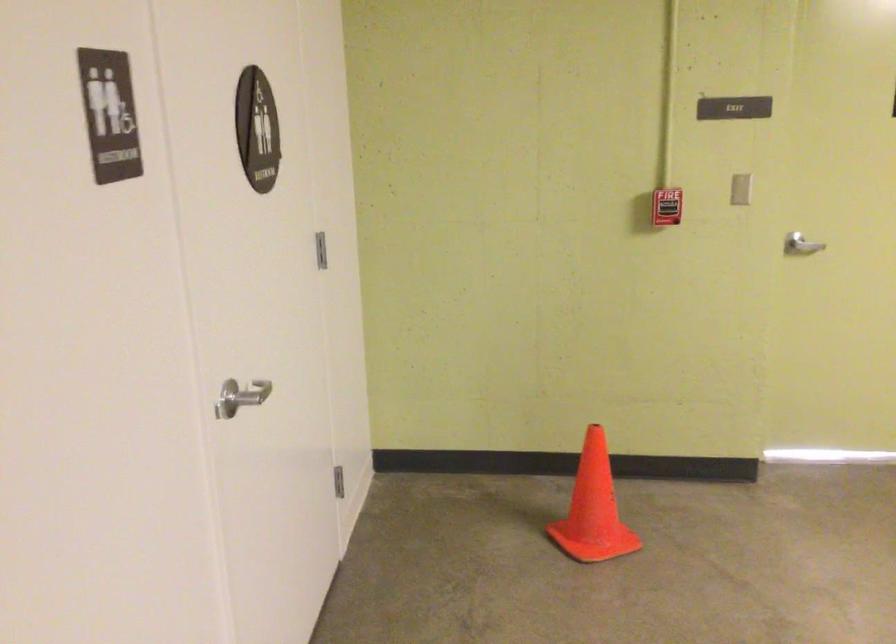
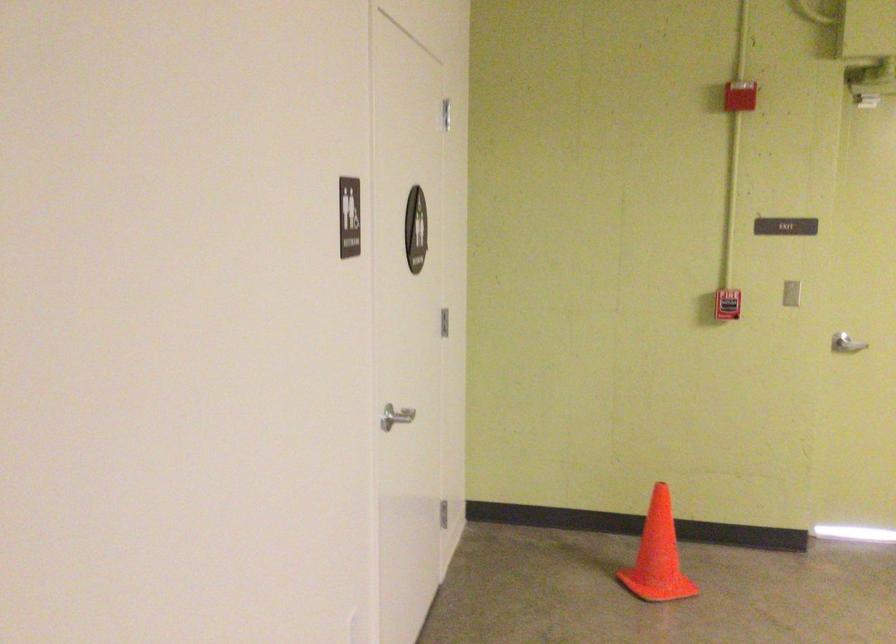
The point at (788, 252) is marked in the first image. Where is the corresponding point in the second image?

(846, 344)